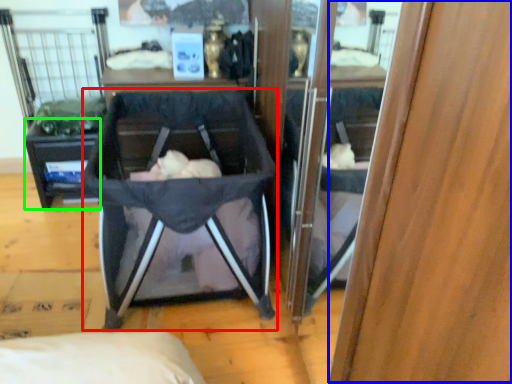
Question: Considering the real-world distances, which object is farthest from baby carriage (highlighted by a red box)? wood (highlighted by a blue box) or vanity (highlighted by a green box)?

Choices:
 (A) wood
 (B) vanity

Answer: (A)